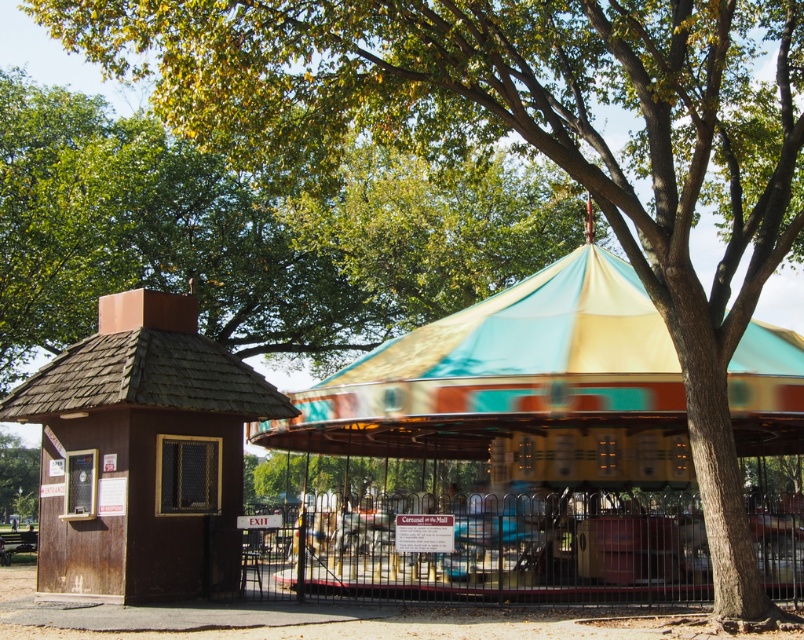
You are standing at the point with coordinates point (517, 387). Looking around, you see the carousel and the wooden booth. Which object is directly in front of you?

The point (517, 387) corresponds to the multicolored fabric carousel at center, so the carousel is directly in front of you.

Looking at this image, you are standing at the center of the image and want to walk towards the multicolored fabric carousel at center. In which direction should you move?

You should move towards the point at coordinates (517, 387) to reach the multicolored fabric carousel at center.

You are standing in the middle of the park and see the multicolored fabric carousel at center and the brown wood gazebo at left. Which object is nearer to you?

The multicolored fabric carousel at center is closer to the viewer than the brown wood gazebo at left, so it is nearer.